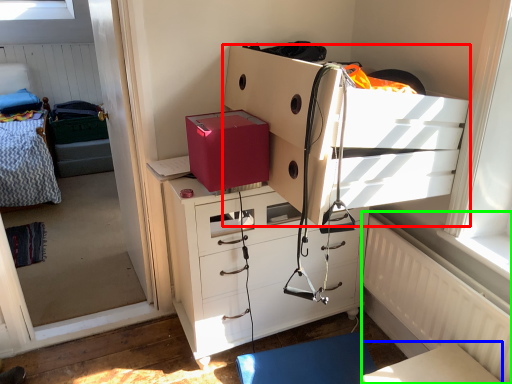
Question: Estimate the real-world distances between objects in this image. Which object is closer to chest of drawers (highlighted by a red box), table (highlighted by a blue box) or radiator (highlighted by a green box)?

Choices:
 (A) table
 (B) radiator

Answer: (B)